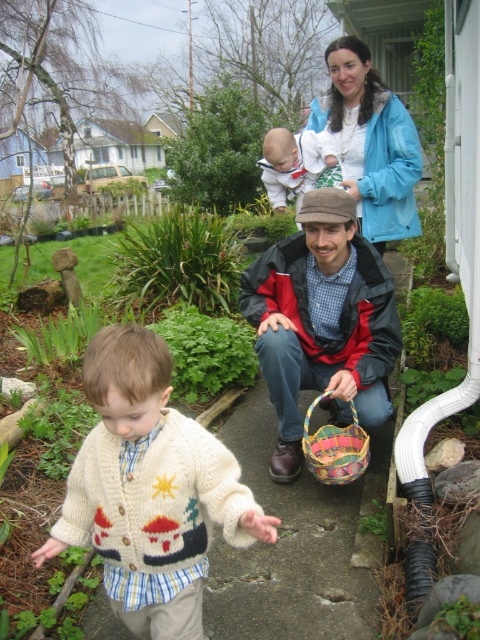
You are a parent trying to decide which jacket to put on your child. You see the red and black jacket at center and the blue fabric jacket at upper center. Which jacket is larger?

The red and black jacket at center is bigger than the blue fabric jacket at upper center, so the red and black jacket at center is the larger one.

You are a delivery robot that needs to place a package in the multicolored woven basket at lower center. The package is 4 feet long. Can you fit the package in the basket without moving the knitted sweater at center?

The knitted sweater at center is 3.71 feet from the multicolored woven basket at lower center. Since the package is 4 feet long, it is slightly longer than the distance between the sweater and the basket. Therefore, the package cannot be placed in the basket without moving the knitted sweater at center.

You are standing on the garden pathway and want to walk towards the point marked as point (327,312). There is another point marked as point (310,461). Which point is closer to you?

Point (327,312) is closer to you because it is further to the camera than point (310,461), meaning it is nearer in your current position.